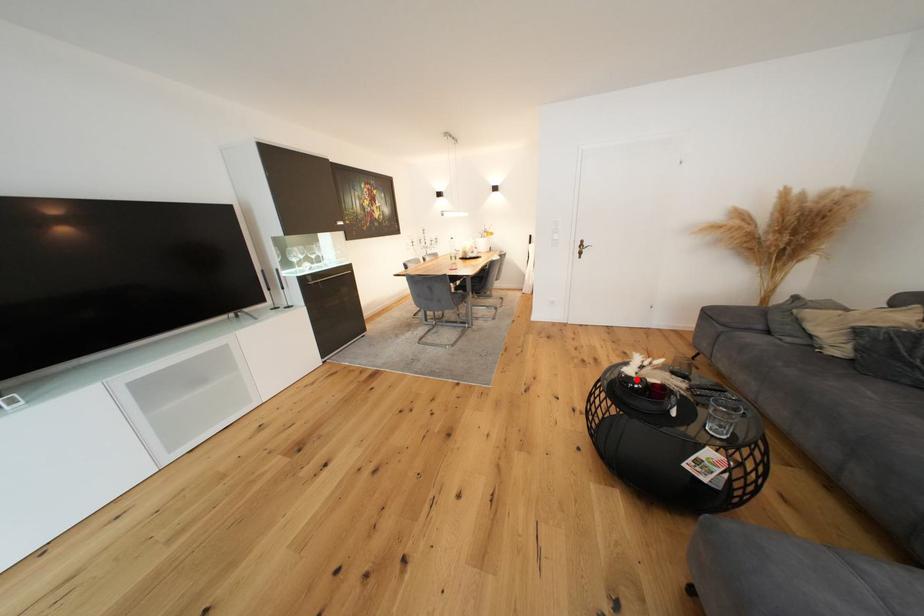
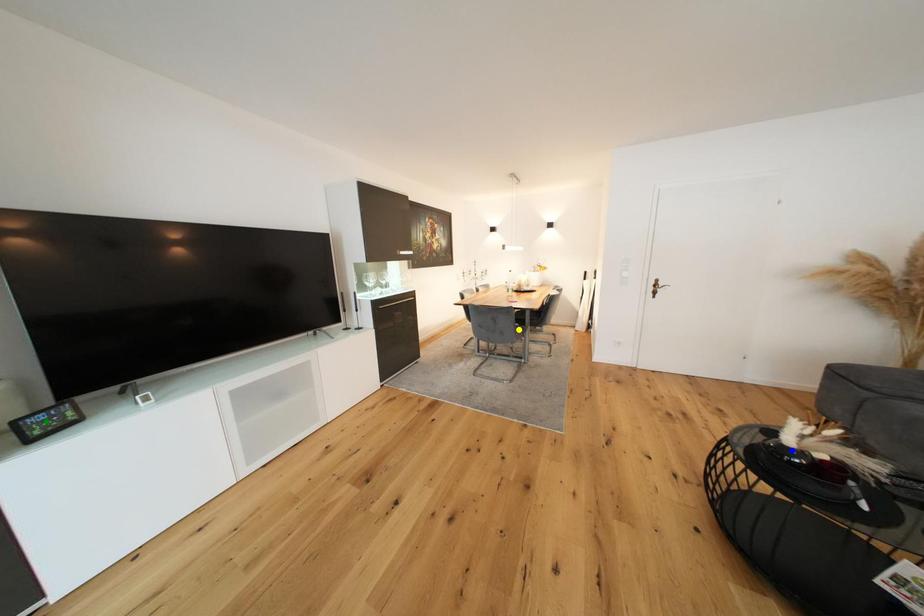
Question: I am providing you with two images of the same scene from different viewpoints. A red point is marked on the first image. You are given multiple points on the second image. Which mark in image 2 goes with the point in image 1?

Choices:
 (A) blue point
 (B) yellow point
 (C) green point

Answer: (A)